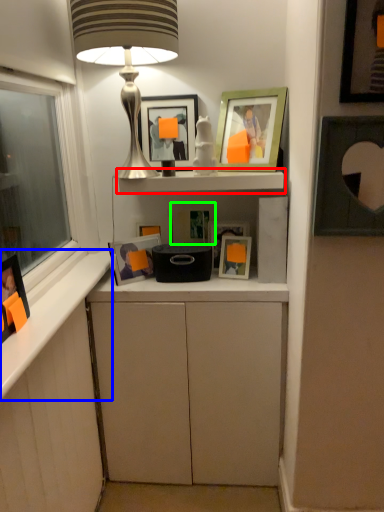
Question: Estimate the real-world distances between objects in this image. Which object is closer to shelf (highlighted by a red box), counter top (highlighted by a blue box) or picture frame (highlighted by a green box)?

Choices:
 (A) counter top
 (B) picture frame

Answer: (B)